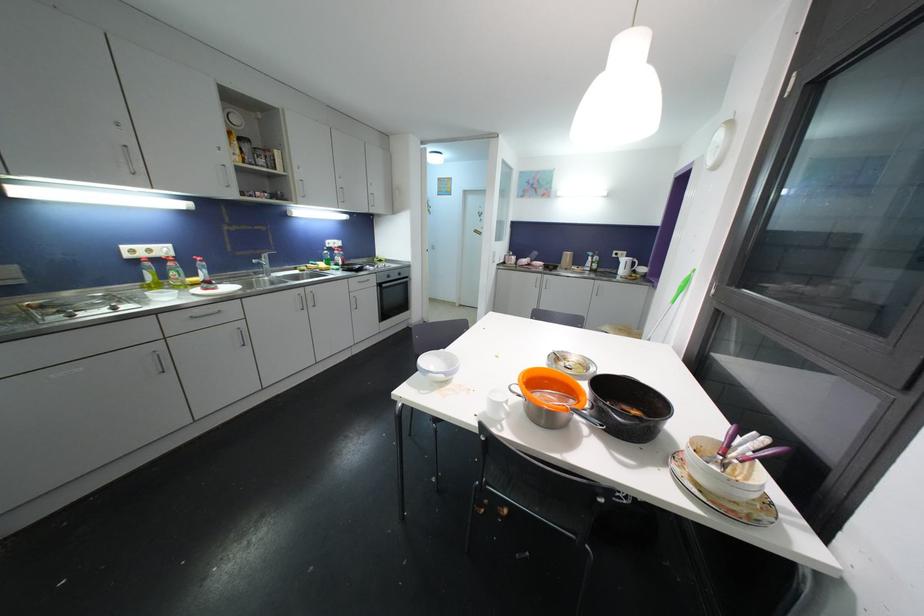
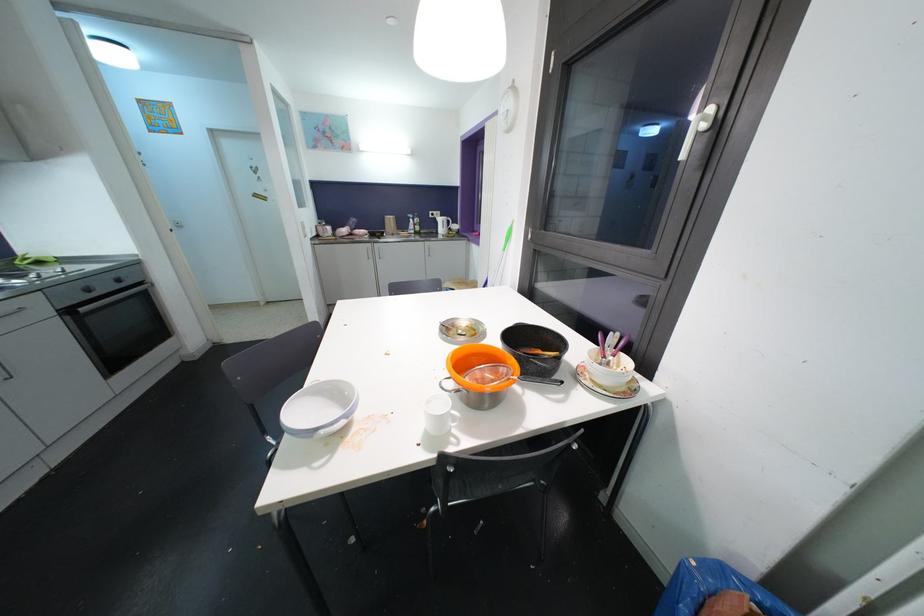
Question: I am providing you with two images of the same scene from different viewpoints. Please identify which objects are invisible in image2.

Choices:
 (A) white window handle
 (B) black pot handle
 (C) metal strainer handle
 (D) none of these

Answer: (D)